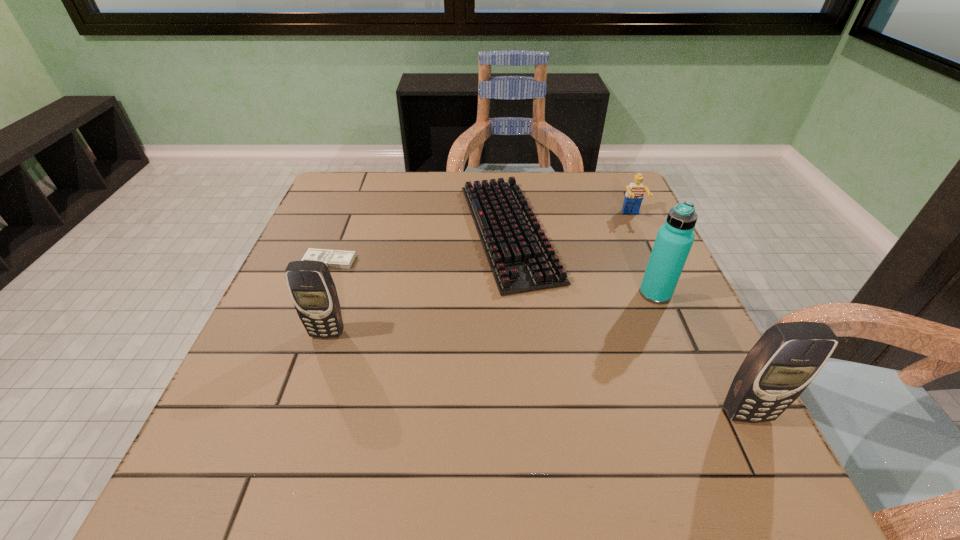
At what (x,y) coordinates should I click in order to perform the action: click on free space located on the right of the fourth object from right to left. Please return your answer as a coordinate pair (x, y). This screenshot has width=960, height=540. Looking at the image, I should click on (642, 232).

Find the location of a particular element. blank space located on the face of the fourth tallest object is located at coordinates (661, 281).

Locate an element on the screen. free space located 0.190m on the front of the shortest object is located at coordinates (302, 330).

Find the location of a particular element. This screenshot has width=960, height=540. blank space located 0.140m on the front of the water bottle is located at coordinates (682, 356).

I want to click on computer keyboard at the far edge, so click(521, 258).

This screenshot has height=540, width=960. I want to click on Lego that is at the far edge, so click(x=634, y=195).

Find the location of `object situated at the near edge`. object situated at the near edge is located at coordinates (788, 356).

The width and height of the screenshot is (960, 540). Find the location of `cellular telephone located in the left edge section of the desktop`. cellular telephone located in the left edge section of the desktop is located at coordinates (313, 292).

This screenshot has width=960, height=540. I want to click on money that is positioned at the left edge, so click(x=332, y=258).

What are the coordinates of `cellular telephone situated at the right edge` in the screenshot? It's located at (788, 356).